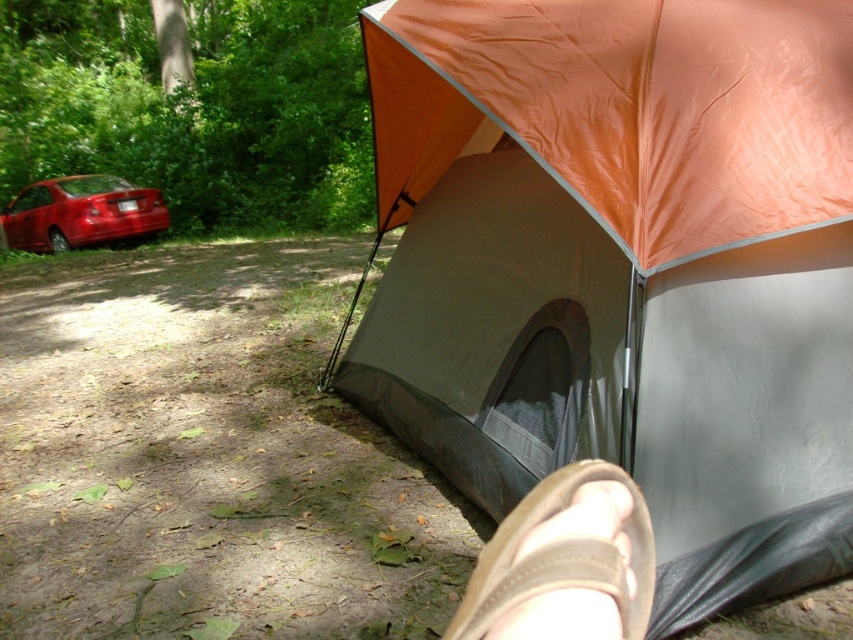
Consider the image. You are standing at the entrance of the orange tarpaulin tent at center and want to check your brown suede sandal at lower right. In which direction should you walk to reach it?

The brown suede sandal at lower right is to the left of the orange tarpaulin tent at center, so you should walk to the left to reach it.

From the picture: You are standing at the center of the image. Which direction should you move to reach the orange tarpaulin tent at upper right?

The orange tarpaulin tent at upper right is located at point (625, 109), so you should move towards the upper right direction to reach it.